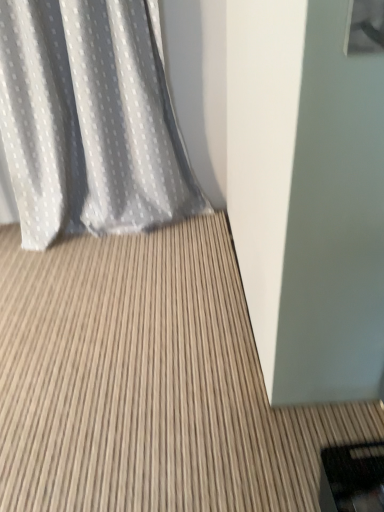
The height and width of the screenshot is (512, 384). What do you see at coordinates (90, 120) in the screenshot? I see `white dotted fabric at upper left` at bounding box center [90, 120].

Locate an element on the screen. Image resolution: width=384 pixels, height=512 pixels. white dotted fabric at upper left is located at coordinates (90, 120).

The width and height of the screenshot is (384, 512). I want to click on white dotted fabric at upper left, so click(x=90, y=120).